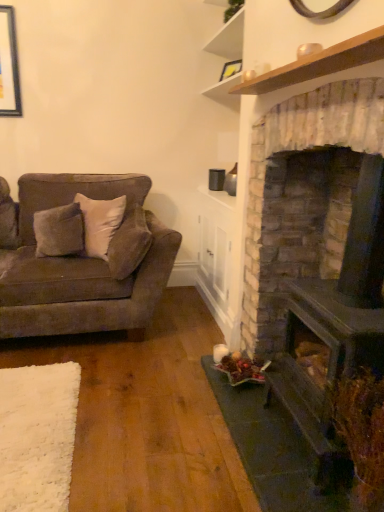
What are the coordinates of `suede-like beige pillow at center-left` in the screenshot? It's located at (129, 243).

Between matte black picture frame at upper center and suede-like beige pillow at center-left, which one has more height?

suede-like beige pillow at center-left.

Which object is further away from the camera taking this photo, matte black picture frame at upper center or suede-like beige pillow at center-left?

matte black picture frame at upper center.

Which is more to the right, matte black picture frame at upper center or suede-like beige pillow at center-left?

matte black picture frame at upper center is more to the right.

From a real-world perspective, does matte black picture frame at upper center sit lower than suede-like beige pillow at center-left?

No, from a real-world perspective, matte black picture frame at upper center is not under suede-like beige pillow at center-left.

Is dark brown stone fireplace at right looking in the opposite direction of suede-like beige pillow at center-left?

No, dark brown stone fireplace at right's orientation is not away from suede-like beige pillow at center-left.

Is dark brown stone fireplace at right positioned behind suede-like beige pillow at center-left?

No, dark brown stone fireplace at right is closer to the camera.

How many degrees apart are the facing directions of dark brown stone fireplace at right and suede-like beige pillow at center-left?

3.13 degrees separate the facing orientations of dark brown stone fireplace at right and suede-like beige pillow at center-left.

Is point (297, 204) positioned in front of point (127, 254)?

Yes, it is.

Is suede-like beige pillow at center-left further to the viewer compared to dark brown stone fireplace at right?

Yes, suede-like beige pillow at center-left is further from the viewer.

Considering the positions of objects suede-like beige pillow at center-left and dark brown stone fireplace at right in the image provided, who is more to the right, suede-like beige pillow at center-left or dark brown stone fireplace at right?

dark brown stone fireplace at right is more to the right.

From a real-world perspective, who is located higher, suede-like beige pillow at center-left or suede-like brown couch at left?

suede-like beige pillow at center-left is physically above.

Considering the sizes of suede-like beige pillow at center-left and suede-like brown couch at left in the image, is suede-like beige pillow at center-left wider or thinner than suede-like brown couch at left?

Considering their sizes, suede-like beige pillow at center-left looks slimmer than suede-like brown couch at left.

Does suede-like beige pillow at center-left turn towards suede-like brown couch at left?

Yes.

Consider the image. How distant is suede-like brown couch at left from matte black picture frame at upper center?

1.51 meters.

How different are the orientations of suede-like brown couch at left and matte black picture frame at upper center in degrees?

The facing directions of suede-like brown couch at left and matte black picture frame at upper center are 70.2 degrees apart.

From the image's perspective, is suede-like brown couch at left above or below matte black picture frame at upper center?

suede-like brown couch at left is situated lower than matte black picture frame at upper center in the image.

Can we say suede-like brown couch at left lies outside matte black picture frame at upper center?

suede-like brown couch at left lies outside matte black picture frame at upper center's area.

Is matte black picture frame at upper center completely or partially outside of suede-like brown couch at left?

matte black picture frame at upper center is positioned outside suede-like brown couch at left.

Between matte black picture frame at upper center and suede-like brown couch at left, which one appears on the right side from the viewer's perspective?

Positioned to the right is matte black picture frame at upper center.

From the image's perspective, would you say matte black picture frame at upper center is positioned over suede-like brown couch at left?

Yes.

Is point (8, 289) positioned before point (352, 159)?

No, it is behind (352, 159).

Is the surface of suede-like brown couch at left in direct contact with dark brown stone fireplace at right?

No, suede-like brown couch at left is not in contact with dark brown stone fireplace at right.

At what (x,y) coordinates should I click in order to perform the action: click on studio couch above the dark brown stone fireplace at right (from the image's perspective). Please return your answer as a coordinate pair (x, y). Image resolution: width=384 pixels, height=512 pixels. Looking at the image, I should click on (79, 258).

At what (x,y) coordinates should I click in order to perform the action: click on picture frame above the suede-like beige pillow at center-left (from the image's perspective). Please return your answer as a coordinate pair (x, y). This screenshot has width=384, height=512. Looking at the image, I should click on (231, 69).

Identify the location of pillow below the dark brown stone fireplace at right (from a real-world perspective). The image size is (384, 512). (129, 243).

Based on their spatial positions, is suede-like beige pillow at center-left or matte black picture frame at upper center further from dark brown stone fireplace at right?

Among the two, matte black picture frame at upper center is located further to dark brown stone fireplace at right.

Looking at this image, from the image, which object appears to be farther from suede-like beige pillow at center-left, suede-like brown couch at left or matte black picture frame at upper center?

matte black picture frame at upper center lies further to suede-like beige pillow at center-left than the other object.

Which object lies further to the anchor point suede-like brown couch at left, suede-like beige pillow at center-left or matte black picture frame at upper center?

Based on the image, matte black picture frame at upper center appears to be further to suede-like brown couch at left.

Considering their positions, is matte black picture frame at upper center positioned further to dark brown stone fireplace at right than suede-like brown couch at left?

Among the two, matte black picture frame at upper center is located further to dark brown stone fireplace at right.

Looking at the image, which one is located closer to suede-like beige pillow at center-left, matte black picture frame at upper center or suede-like brown couch at left?

The object closer to suede-like beige pillow at center-left is suede-like brown couch at left.

Estimate the real-world distances between objects in this image. Which object is further from suede-like brown couch at left, dark brown stone fireplace at right or matte black picture frame at upper center?

Based on the image, matte black picture frame at upper center appears to be further to suede-like brown couch at left.

Estimate the real-world distances between objects in this image. Which object is further from suede-like beige pillow at center-left, dark brown stone fireplace at right or matte black picture frame at upper center?

Based on the image, matte black picture frame at upper center appears to be further to suede-like beige pillow at center-left.

Estimate the real-world distances between objects in this image. Which object is further from suede-like brown couch at left, suede-like beige pillow at center-left or dark brown stone fireplace at right?

Among the two, dark brown stone fireplace at right is located further to suede-like brown couch at left.

Where is `pillow positioned between dark brown stone fireplace at right and matte black picture frame at upper center from near to far`? The height and width of the screenshot is (512, 384). pillow positioned between dark brown stone fireplace at right and matte black picture frame at upper center from near to far is located at coordinates (129, 243).

Where is `pillow that lies between matte black picture frame at upper center and suede-like brown couch at left from top to bottom`? The image size is (384, 512). pillow that lies between matte black picture frame at upper center and suede-like brown couch at left from top to bottom is located at coordinates (129, 243).

Identify the location of studio couch between dark brown stone fireplace at right and matte black picture frame at upper center from front to back. This screenshot has width=384, height=512. (79, 258).

Find the location of a particular element. pillow located between suede-like brown couch at left and dark brown stone fireplace at right in the left-right direction is located at coordinates (129, 243).